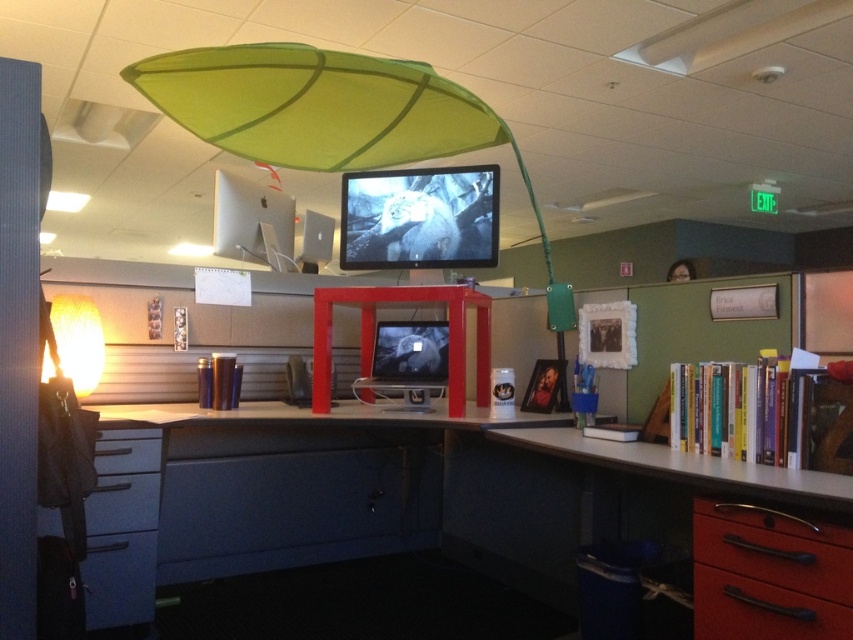
Question: Which point is closer to the camera taking this photo?

Choices:
 (A) (757, 474)
 (B) (711, 561)

Answer: (A)

Question: Can you confirm if metallic gray desk at right is positioned above matte gray drawer at lower left?

Choices:
 (A) no
 (B) yes

Answer: (A)

Question: Estimate the real-world distances between objects in this image. Which object is farther from the blue plastic drawer at lower left?

Choices:
 (A) black metal drawer at lower right
 (B) matte gray drawer at lower left
 (C) matte gray computer desk at center

Answer: (A)

Question: Is matte gray computer desk at center positioned at the back of blue plastic drawer at lower left?

Choices:
 (A) yes
 (B) no

Answer: (B)

Question: Can you confirm if matte gray computer desk at center is wider than hardcover books at right?

Choices:
 (A) no
 (B) yes

Answer: (B)

Question: Among these points, which one is farthest from the camera?

Choices:
 (A) (128, 612)
 (B) (712, 628)
 (C) (134, 454)

Answer: (C)